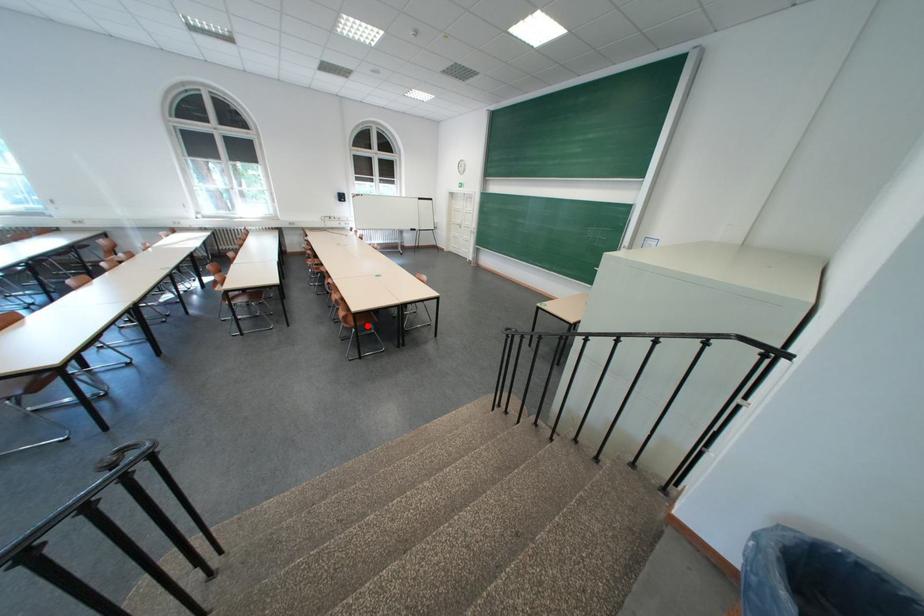
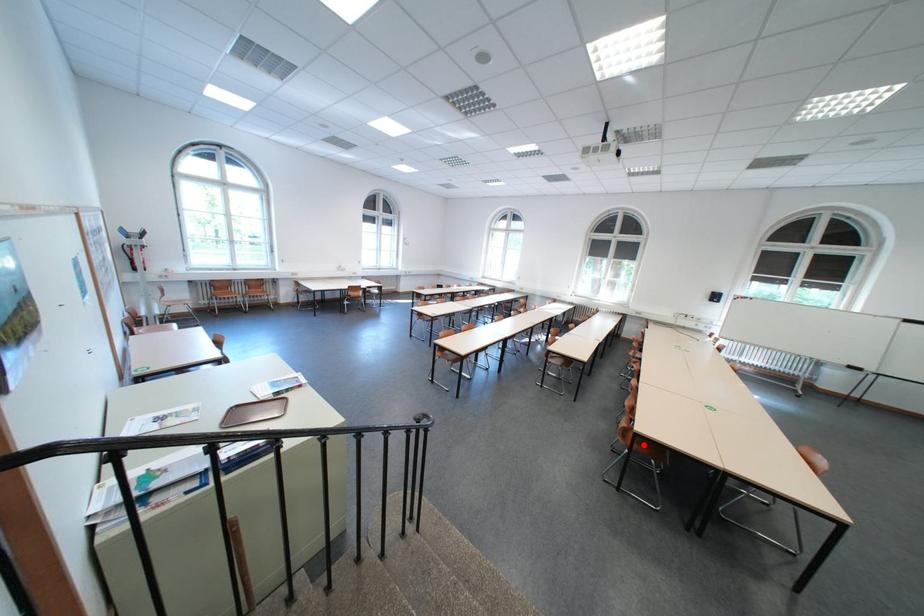
I am providing you with two images of the same scene from different viewpoints. A red point is marked on the first image and another point is marked on the second image. Does the point marked in image1 correspond to the same location as the one in image2?

Yes